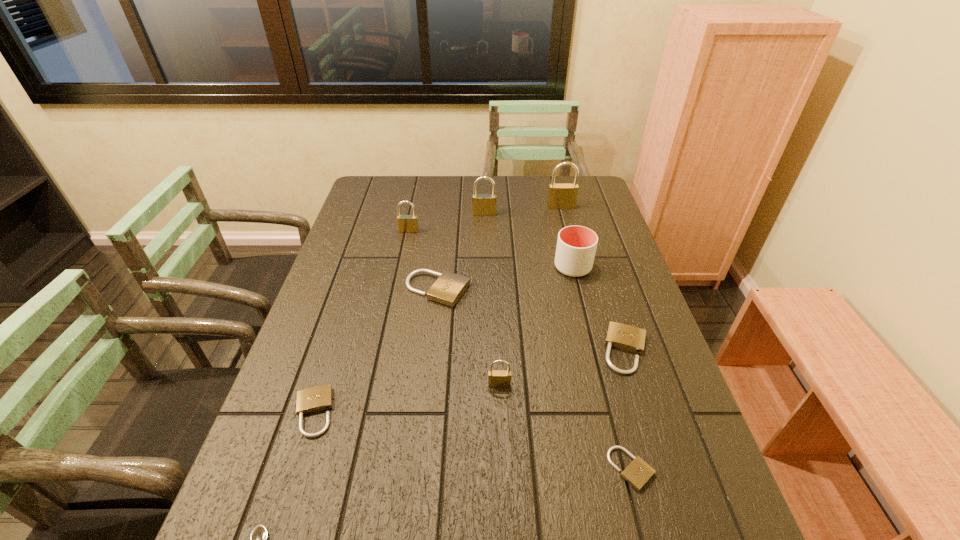
You are a GUI agent. You are given a task and a screenshot of the screen. Output one action in this format:
    pyautogui.click(x=<x>, y=<y>)
    Task: Click on the vacant area that lies between the nearest brass padlock and the fourth farthest padlock
    The height and width of the screenshot is (540, 960).
    Given the screenshot: What is the action you would take?
    pyautogui.click(x=468, y=338)

The height and width of the screenshot is (540, 960). I want to click on empty space between the cup and the second nearest beige padlock, so click(x=443, y=340).

Where is `empty space that is in between the biggest beige padlock and the third nearest beige padlock`? This screenshot has width=960, height=540. empty space that is in between the biggest beige padlock and the third nearest beige padlock is located at coordinates (532, 320).

Image resolution: width=960 pixels, height=540 pixels. In order to click on free space between the leftmost beige padlock and the fifth tallest padlock in this screenshot , I will do `click(375, 351)`.

Locate which object ranks in proximity to the sixth tallest object. Please provide its 2D coordinates. Your answer should be formatted as a tuple, i.e. [(x, y)], where the tuple contains the x and y coordinates of a point satisfying the conditions above.

[(406, 223)]

Image resolution: width=960 pixels, height=540 pixels. Identify the location of object that is the fifth closest to the sixth shortest padlock. (315, 399).

Identify the location of padlock that is the fifth closest to the soupspoon. (621, 336).

Identify which padlock is the fifth nearest to the soupspoon. Please provide its 2D coordinates. Your answer should be formatted as a tuple, i.e. [(x, y)], where the tuple contains the x and y coordinates of a point satisfying the conditions above.

[(621, 336)]

Choose which brass padlock is the third nearest neighbor to the sixth farthest object. Please provide its 2D coordinates. Your answer should be formatted as a tuple, i.e. [(x, y)], where the tuple contains the x and y coordinates of a point satisfying the conditions above.

[(482, 204)]

The width and height of the screenshot is (960, 540). Find the location of `brass padlock that is the third closest to the third farthest object`. brass padlock that is the third closest to the third farthest object is located at coordinates (496, 378).